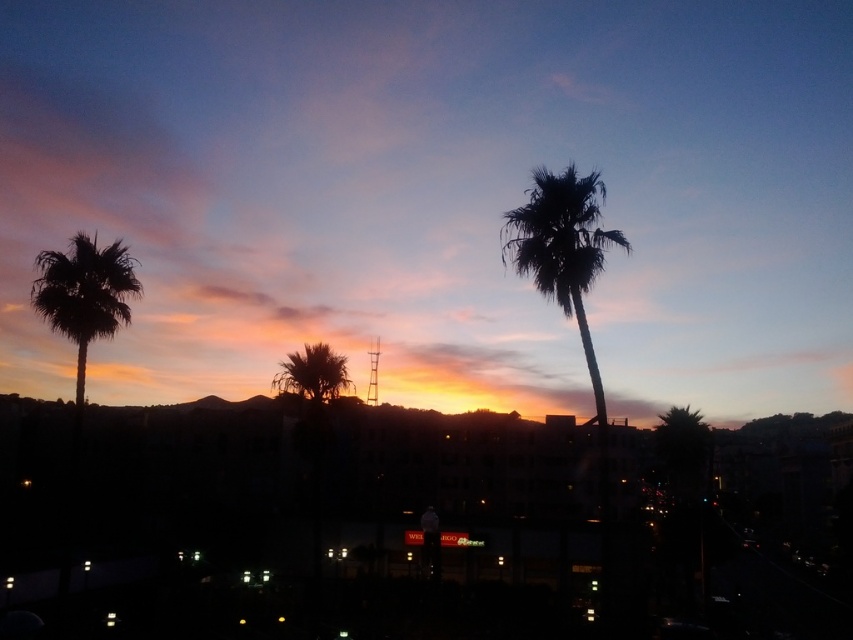
From the picture: You are a photographer trying to capture the sunset between the two silhouette palms. The distance between them is crucial for your shot. Given that your camera can focus on objects up to 15 meters apart, will the silhouette palm at center and the silhouette palm at left be within your camera range?

The silhouette palm at center is 17.00 meters from the silhouette palm at left. Since your camera can focus on objects up to 15 meters apart, the distance between them exceeds the camera range, so they will not be within range.